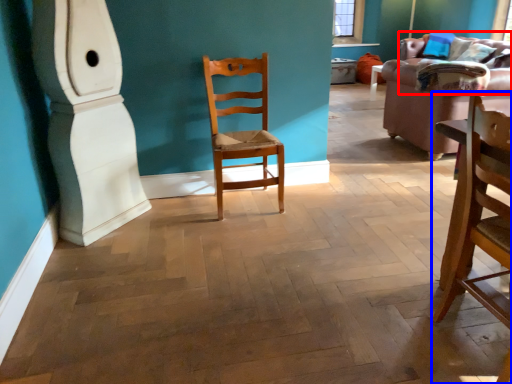
Question: Which object appears farthest to the camera in this image, couch (highlighted by a red box) or chair (highlighted by a blue box)?

Choices:
 (A) couch
 (B) chair

Answer: (A)